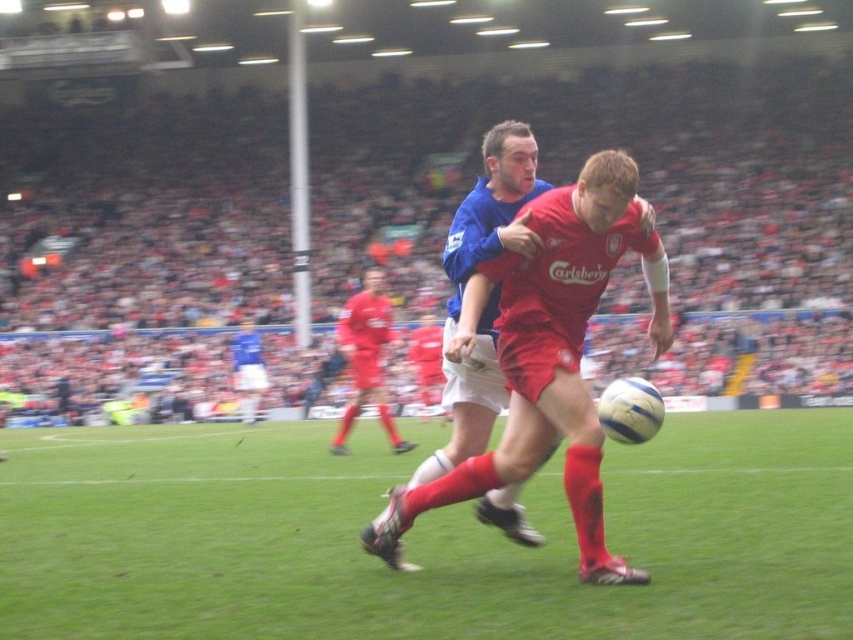
Question: Which of the following is the farthest from the observer?

Choices:
 (A) green grass at center
 (B) blue jersey at center
 (C) matte red soccer player at center

Answer: (C)

Question: Which object is the farthest from the blue jersey at center?

Choices:
 (A) green grass at center
 (B) matte red soccer player at center

Answer: (B)

Question: Can you confirm if green grass at center is positioned to the right of blue jersey at center?

Choices:
 (A) no
 (B) yes

Answer: (A)

Question: Which object appears closest to the camera in this image?

Choices:
 (A) matte red soccer player at center
 (B) green grass at center
 (C) blue jersey at center

Answer: (B)

Question: Is green grass at center positioned behind blue jersey at center?

Choices:
 (A) no
 (B) yes

Answer: (A)

Question: Observing the image, what is the correct spatial positioning of blue jersey at center in reference to matte red soccer player at center?

Choices:
 (A) right
 (B) left

Answer: (A)